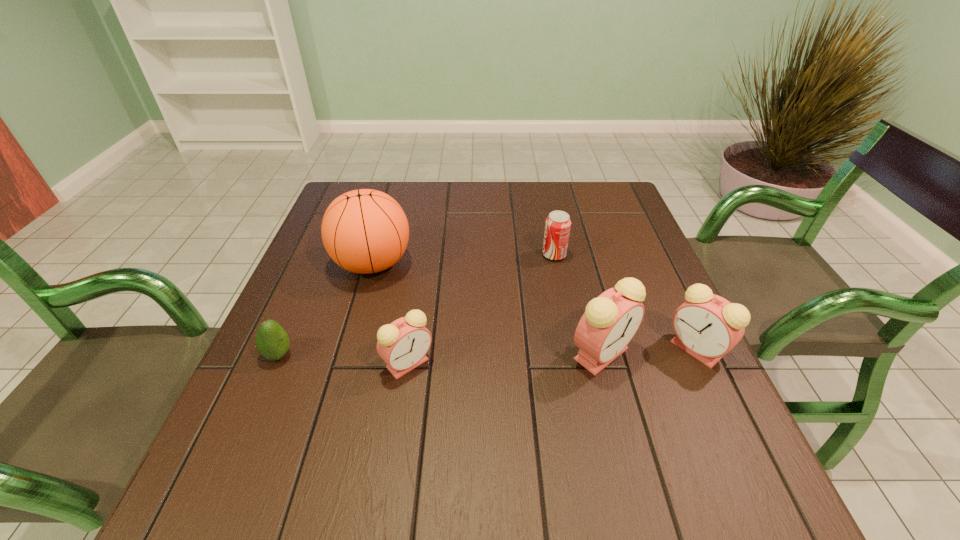
At what (x,y) coordinates should I click in order to perform the action: click on unoccupied position between the fourth shortest object and the second alarm clock from right to left. Please return your answer as a coordinate pair (x, y). Looking at the image, I should click on [649, 352].

This screenshot has width=960, height=540. Identify the location of free space that is in between the shortest alarm clock and the second alarm clock from left to right. (505, 359).

Find the location of `unoccupied position between the avocado and the basketball`. unoccupied position between the avocado and the basketball is located at coordinates (325, 309).

Locate an element on the screen. This screenshot has height=540, width=960. vacant region between the avocado and the second alarm clock from left to right is located at coordinates (440, 354).

Locate an element on the screen. Image resolution: width=960 pixels, height=540 pixels. free space between the rightmost alarm clock and the second alarm clock from left to right is located at coordinates [649, 352].

You are a GUI agent. You are given a task and a screenshot of the screen. Output one action in this format:
    pyautogui.click(x=<x>, y=<y>)
    Task: Click on the unoccupied position between the second alarm clock from right to left and the avocado
    
    Given the screenshot: What is the action you would take?
    (440, 354)

Identify which object is located as the fifth nearest to the shortest alarm clock. Please provide its 2D coordinates. Your answer should be formatted as a tuple, i.e. [(x, y)], where the tuple contains the x and y coordinates of a point satisfying the conditions above.

[(707, 326)]

Identify which object is the second closest to the basketball. Please provide its 2D coordinates. Your answer should be formatted as a tuple, i.e. [(x, y)], where the tuple contains the x and y coordinates of a point satisfying the conditions above.

[(403, 344)]

Select which alarm clock appears as the second closest to the soda can. Please provide its 2D coordinates. Your answer should be formatted as a tuple, i.e. [(x, y)], where the tuple contains the x and y coordinates of a point satisfying the conditions above.

[(707, 326)]

Choose which alarm clock is the second nearest neighbor to the second alarm clock from right to left. Please provide its 2D coordinates. Your answer should be formatted as a tuple, i.e. [(x, y)], where the tuple contains the x and y coordinates of a point satisfying the conditions above.

[(403, 344)]